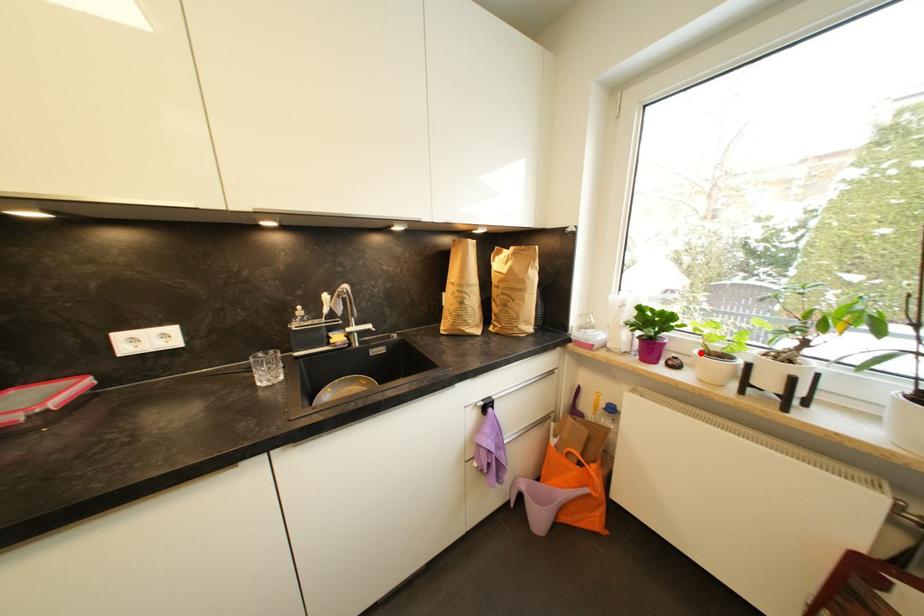
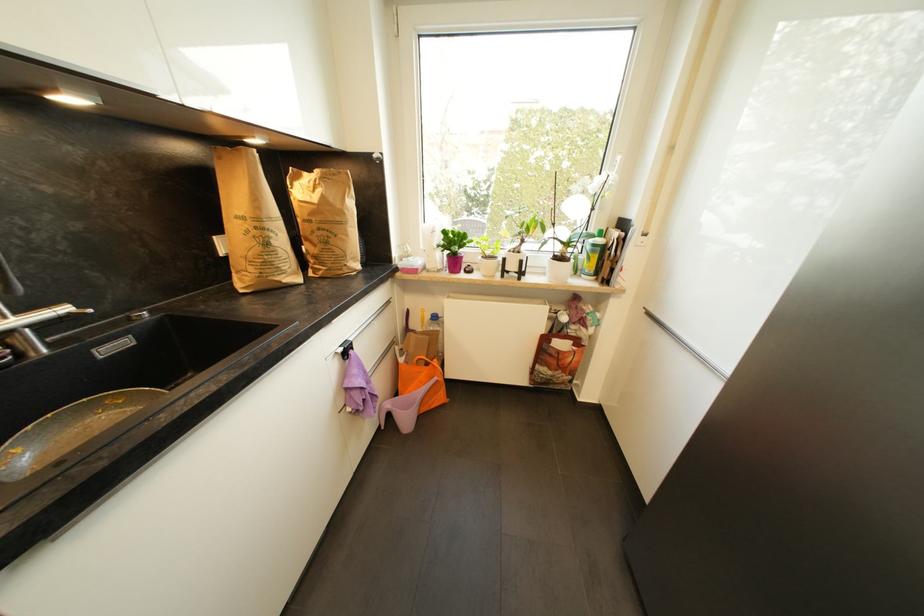
In the second image, find the point that corresponds to the highlighted location in the first image.

(484, 259)